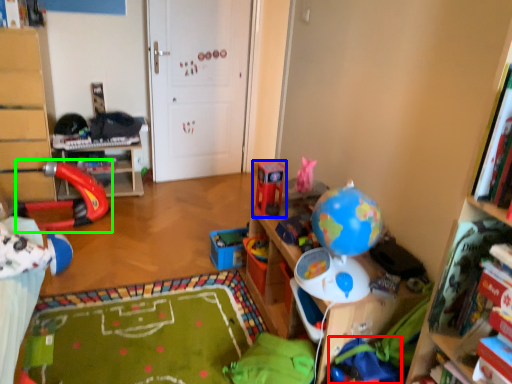
Question: Which object is the closest to the toy (highlighted by a red box)? Choose among these: toy (highlighted by a blue box) or toy (highlighted by a green box).

Choices:
 (A) toy
 (B) toy

Answer: (A)